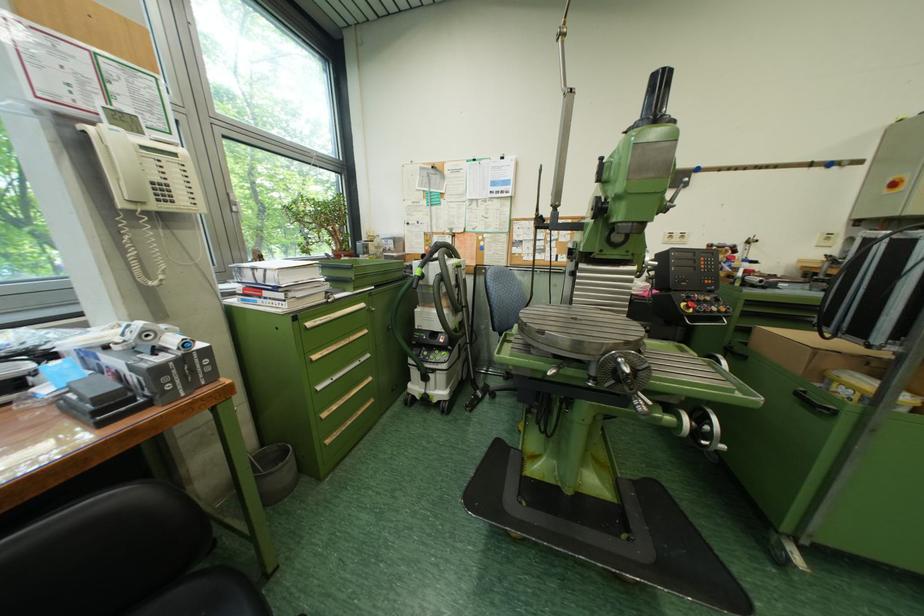
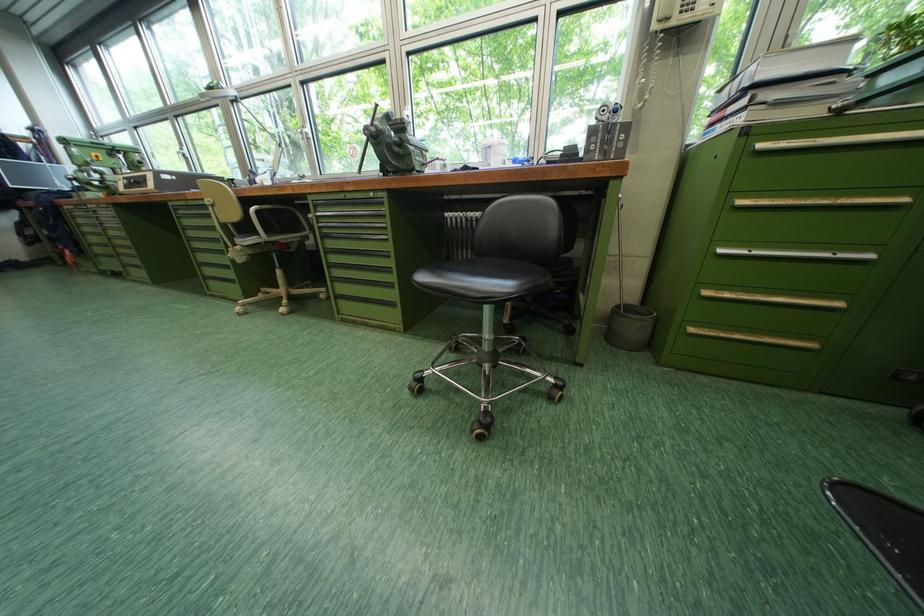
How did the camera likely rotate?

The camera rotated toward left-down.